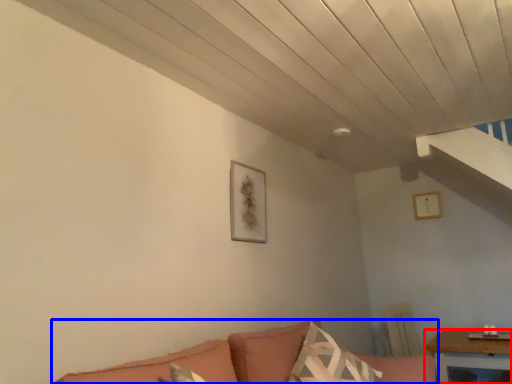
Question: Which object is closer to the camera taking this photo, table (highlighted by a red box) or studio couch (highlighted by a blue box)?

Choices:
 (A) table
 (B) studio couch

Answer: (B)